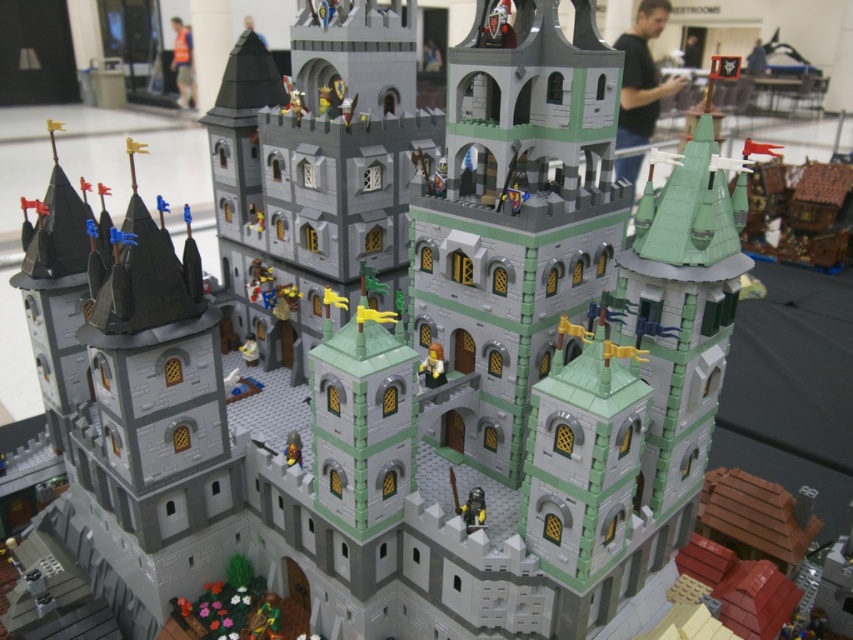
Can you confirm if light brown plastic minifigure at center is shorter than light blue plastic minifigure at center?

In fact, light brown plastic minifigure at center may be taller than light blue plastic minifigure at center.

Who is positioned more to the left, light brown plastic minifigure at center or light blue plastic minifigure at center?

light blue plastic minifigure at center is more to the left.

Describe the element at coordinates (433, 365) in the screenshot. The image size is (853, 640). I see `light brown plastic minifigure at center` at that location.

I want to click on light brown plastic minifigure at center, so click(433, 365).

Is point (468, 493) farther from viewer compared to point (254, 355)?

No, it is in front of (254, 355).

Does shiny metallic knight at lower center appear on the right side of light blue plastic minifigure at center?

Correct, you'll find shiny metallic knight at lower center to the right of light blue plastic minifigure at center.

Does point (469, 515) come in front of point (242, 355)?

Yes, it is in front of point (242, 355).

You are a GUI agent. You are given a task and a screenshot of the screen. Output one action in this format:
    pyautogui.click(x=<x>, y=<y>)
    Task: Click on the shiny metallic knight at lower center
    The image size is (853, 640).
    Given the screenshot: What is the action you would take?
    pyautogui.click(x=473, y=509)

Which is below, shiny metallic knight at lower center or light brown plastic minifigure at center?

shiny metallic knight at lower center is below.

Is shiny metallic knight at lower center positioned at the back of light brown plastic minifigure at center?

No, shiny metallic knight at lower center is in front of light brown plastic minifigure at center.

Is point (463, 520) more distant than point (434, 342)?

No, it is in front of (434, 342).

The image size is (853, 640). I want to click on shiny metallic knight at lower center, so click(473, 509).